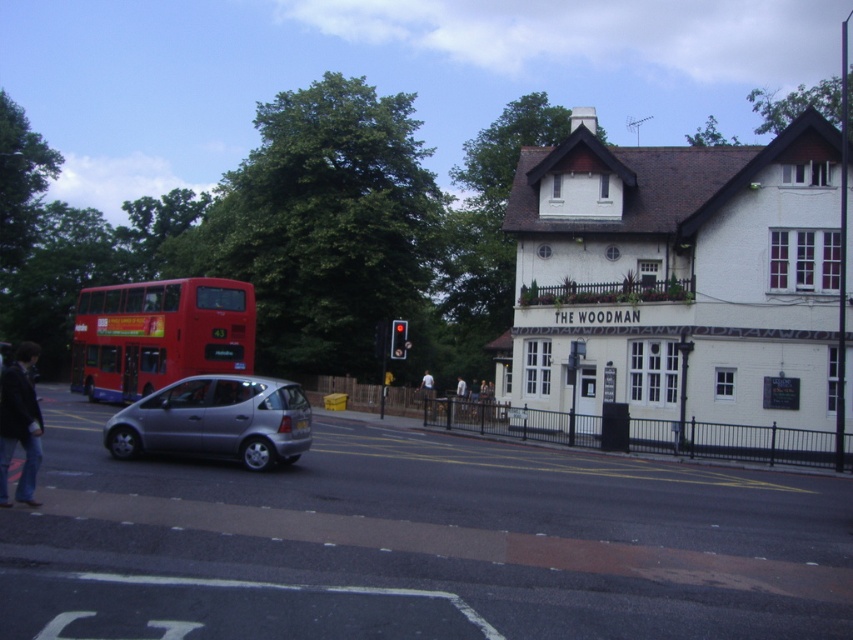
Question: Is silver metallic car at center wider than dark blue jeans at lower left?

Choices:
 (A) no
 (B) yes

Answer: (B)

Question: Among these objects, which one is farthest from the camera?

Choices:
 (A) red rubber double-decker bus at left
 (B) dark blue jeans at lower left
 (C) silver metallic car at center

Answer: (A)

Question: Can you confirm if silver metallic car at center is positioned to the right of satin silver hatchback at center?

Choices:
 (A) no
 (B) yes

Answer: (B)

Question: Is silver metallic car at center smaller than dark blue jeans at lower left?

Choices:
 (A) yes
 (B) no

Answer: (B)

Question: Which point is closer to the camera?

Choices:
 (A) (283, 385)
 (B) (222, 333)
 (C) (55, 440)
 (D) (28, 464)

Answer: (D)

Question: Which object is closer to the camera taking this photo?

Choices:
 (A) silver metallic car at center
 (B) red rubber double-decker bus at left
 (C) satin silver hatchback at center
 (D) dark blue jeans at lower left

Answer: (A)